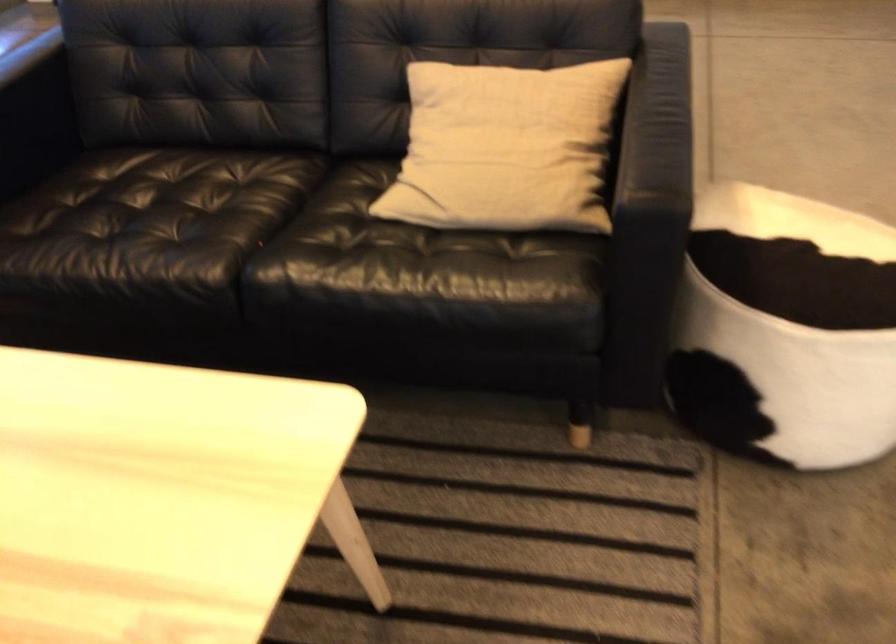
Find where to lift the beige throw pillow. Please return your answer as a coordinate pair (x, y).

(505, 147)